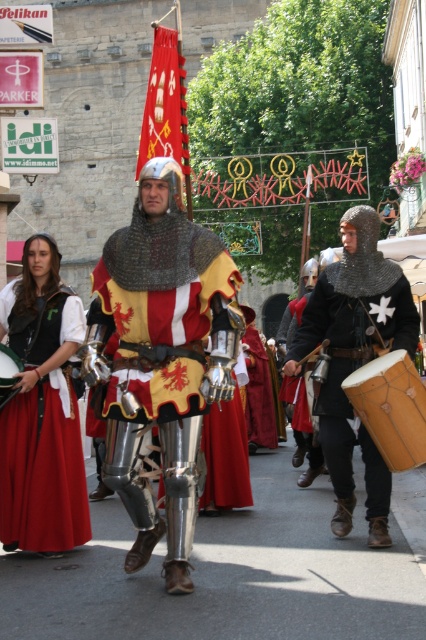
You are a photographer at the medieval procession. You need to capture a photo where both the shiny silver armor at center and the wooden drum at center are clearly visible. Given their sizes, which object should you focus on to ensure both are in frame without cropping?

The shiny silver armor at center is larger than the wooden drum at center, so you should focus on the shiny silver armor at center to ensure both objects fit within the frame without cropping.

You are a participant in the medieval procession and need to adjust your outfit. You notice the metallic chainmail helmet at center and the matte red skirt at center. Which item is positioned higher on your body?

The metallic chainmail helmet at center is above the matte red skirt at center, so the helmet is positioned higher on your body.